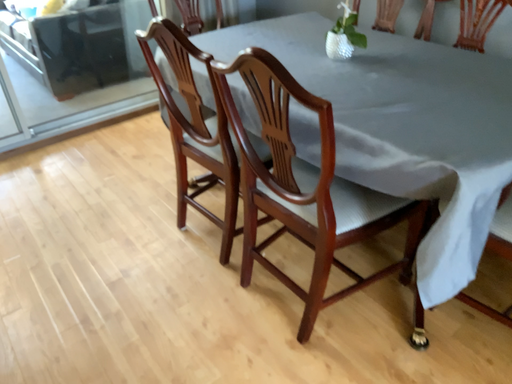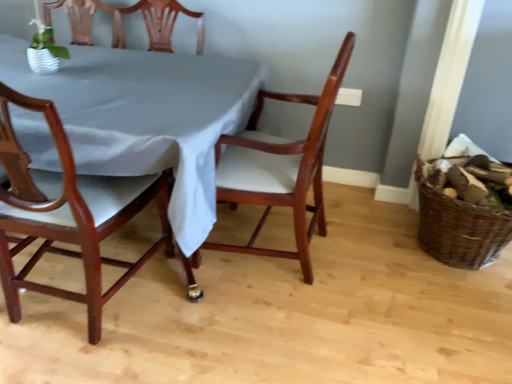
Question: Which way did the camera rotate in the video?

Choices:
 (A) rotated right
 (B) rotated left

Answer: (A)